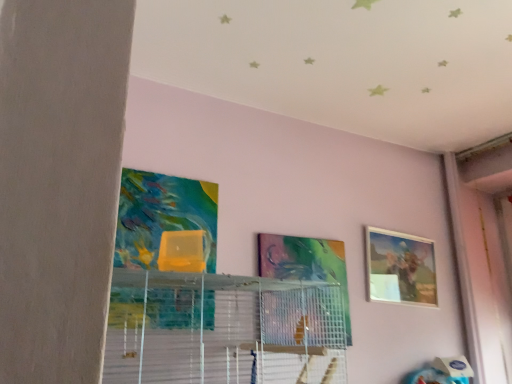
Question: Is metallic silver picture frame at center, which appears as the 2th picture frame when viewed from the back, spatially inside matte wooden picture frame at upper right, which appears as the 1th picture frame when viewed from the back, or outside of it?

Choices:
 (A) outside
 (B) inside

Answer: (A)

Question: Is point (311, 261) closer or farther from the camera than point (394, 286)?

Choices:
 (A) farther
 (B) closer

Answer: (B)

Question: Which object is positioned farthest from the clear plastic shelf at center?

Choices:
 (A) matte wooden picture frame at upper right, which appears as the 1th picture frame when viewed from the back
 (B) metallic silver picture frame at center, which appears as the 2th picture frame when viewed from the back

Answer: (A)

Question: Based on their relative distances, which object is farther from the metallic silver picture frame at center, which appears as the second picture frame when viewed from the right?

Choices:
 (A) clear plastic shelf at center
 (B) matte wooden picture frame at upper right, which is the first picture frame in right-to-left order

Answer: (B)